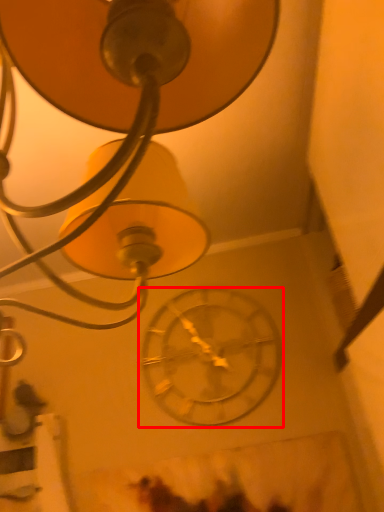
Question: From the image's perspective, where is wall clock (annotated by the red box) located relative to lamp?

Choices:
 (A) below
 (B) above

Answer: (A)